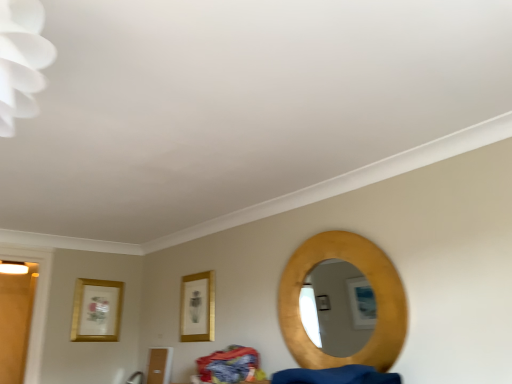
Image resolution: width=512 pixels, height=384 pixels. Describe the element at coordinates (96, 310) in the screenshot. I see `gold metallic picture frame at left, the 1th picture frame positioned from the left` at that location.

The image size is (512, 384). Describe the element at coordinates (197, 307) in the screenshot. I see `gold metallic picture frame at center, the 1th picture frame in the front-to-back sequence` at that location.

I want to click on gold metallic picture frame at left, the 1th picture frame positioned from the left, so click(x=96, y=310).

Find the location of a particular element. This screenshot has height=384, width=512. picture frame that is the 1st one when counting downward from the gold textured mirror at right (from the image's perspective) is located at coordinates pos(197,307).

Is gold textured mirror at right facing away from gold metallic picture frame at center, the 2th picture frame in the back-to-front sequence?

gold textured mirror at right does not have its back to gold metallic picture frame at center, the 2th picture frame in the back-to-front sequence.

Considering the relative sizes of gold textured mirror at right and gold metallic picture frame at center, the 1th picture frame in the front-to-back sequence, in the image provided, is gold textured mirror at right wider than gold metallic picture frame at center, the 1th picture frame in the front-to-back sequence,?

Indeed, gold textured mirror at right has a greater width compared to gold metallic picture frame at center, the 1th picture frame in the front-to-back sequence.

From the image's perspective, does gold metallic picture frame at left, the 1th picture frame positioned from the left, appear higher than gold textured mirror at right?

No, from the image's perspective, gold metallic picture frame at left, the 1th picture frame positioned from the left, is not over gold textured mirror at right.

Choose the correct answer: Is gold metallic picture frame at left, the second picture frame from the right, inside gold textured mirror at right or outside it?

gold metallic picture frame at left, the second picture frame from the right, lies outside gold textured mirror at right.

Is point (106, 284) positioned in front of point (291, 305)?

That is False.

Between gold metallic picture frame at left, the 1th picture frame positioned from the left, and gold textured mirror at right, which one appears on the left side from the viewer's perspective?

gold metallic picture frame at left, the 1th picture frame positioned from the left.

From a real-world perspective, is gold metallic picture frame at center, arranged as the first picture frame when viewed from the right, beneath gold textured mirror at right?

No.

From the image's perspective, does gold metallic picture frame at center, arranged as the first picture frame when viewed from the right, appear lower than gold textured mirror at right?

Correct, gold metallic picture frame at center, arranged as the first picture frame when viewed from the right, appears lower than gold textured mirror at right in the image.

Which is more to the right, gold metallic picture frame at center, the 2th picture frame in the back-to-front sequence, or gold textured mirror at right?

Positioned to the right is gold textured mirror at right.

Is gold metallic picture frame at center, the 1th picture frame in the front-to-back sequence, turned away from gold metallic picture frame at left, the 1th picture frame positioned from the left?

That's not correct — gold metallic picture frame at center, the 1th picture frame in the front-to-back sequence, is not looking away from gold metallic picture frame at left, the 1th picture frame positioned from the left.

In terms of width, does gold metallic picture frame at center, the 2th picture frame in the back-to-front sequence, look wider or thinner when compared to gold metallic picture frame at left, the second picture frame from the right?

In the image, gold metallic picture frame at center, the 2th picture frame in the back-to-front sequence, appears to be wider than gold metallic picture frame at left, the second picture frame from the right.

Between gold metallic picture frame at center, arranged as the first picture frame when viewed from the right, and gold metallic picture frame at left, which is the first picture frame in back-to-front order, which one is positioned behind?

gold metallic picture frame at left, which is the first picture frame in back-to-front order, is further away from the camera.

From the picture: Can you confirm if gold metallic picture frame at center, the 1th picture frame in the front-to-back sequence, is bigger than gold metallic picture frame at left, the 1th picture frame positioned from the left?

Correct, gold metallic picture frame at center, the 1th picture frame in the front-to-back sequence, is larger in size than gold metallic picture frame at left, the 1th picture frame positioned from the left.

Which of these two, gold textured mirror at right or gold metallic picture frame at left, which is counted as the 2th picture frame, starting from the front, is smaller?

gold metallic picture frame at left, which is counted as the 2th picture frame, starting from the front.

Which picture frame is the 2nd one when counting from the back of the gold textured mirror at right? Please provide its 2D coordinates.

[(96, 310)]

Looking at this image, considering the sizes of objects gold textured mirror at right and gold metallic picture frame at left, which is the first picture frame in back-to-front order, in the image provided, who is taller, gold textured mirror at right or gold metallic picture frame at left, which is the first picture frame in back-to-front order,?

With more height is gold textured mirror at right.

In the scene shown: Would you say gold metallic picture frame at left, the 1th picture frame positioned from the left, is a long distance from gold metallic picture frame at center, the 2th picture frame in the back-to-front sequence?

That's not correct — gold metallic picture frame at left, the 1th picture frame positioned from the left, is a little close to gold metallic picture frame at center, the 2th picture frame in the back-to-front sequence.

Considering the relative sizes of gold metallic picture frame at left, the 1th picture frame positioned from the left, and gold metallic picture frame at center, the 1th picture frame in the front-to-back sequence, in the image provided, is gold metallic picture frame at left, the 1th picture frame positioned from the left, bigger than gold metallic picture frame at center, the 1th picture frame in the front-to-back sequence,?

Actually, gold metallic picture frame at left, the 1th picture frame positioned from the left, might be smaller than gold metallic picture frame at center, the 1th picture frame in the front-to-back sequence.

Is gold metallic picture frame at center, the 1th picture frame in the front-to-back sequence, completely or partially inside gold metallic picture frame at left, which is counted as the 2th picture frame, starting from the front?

No, gold metallic picture frame at left, which is counted as the 2th picture frame, starting from the front, does not contain gold metallic picture frame at center, the 1th picture frame in the front-to-back sequence.

How different are the orientations of gold metallic picture frame at left, the 1th picture frame positioned from the left, and gold metallic picture frame at center, the 2th picture frame in the back-to-front sequence, in degrees?

89.2 degrees.

The height and width of the screenshot is (384, 512). I want to click on the 1st picture frame above the gold textured mirror at right (from a real-world perspective), so click(x=197, y=307).

From the gold textured mirror at right, count the 2nd picture frame to the left and point to it. Please provide its 2D coordinates.

[(96, 310)]

Estimate the real-world distances between objects in this image. Which object is further from gold metallic picture frame at center, the second picture frame when ordered from left to right, gold textured mirror at right or gold metallic picture frame at left, which is counted as the 2th picture frame, starting from the front?

gold textured mirror at right is further to gold metallic picture frame at center, the second picture frame when ordered from left to right.

Estimate the real-world distances between objects in this image. Which object is closer to gold metallic picture frame at center, the 2th picture frame in the back-to-front sequence, gold metallic picture frame at left, which is counted as the 2th picture frame, starting from the front, or gold textured mirror at right?

Based on the image, gold metallic picture frame at left, which is counted as the 2th picture frame, starting from the front, appears to be nearer to gold metallic picture frame at center, the 2th picture frame in the back-to-front sequence.

Looking at the image, which one is located further to gold textured mirror at right, gold metallic picture frame at center, the second picture frame when ordered from left to right, or gold metallic picture frame at left, which is the first picture frame in back-to-front order?

gold metallic picture frame at left, which is the first picture frame in back-to-front order, lies further to gold textured mirror at right than the other object.

From the image, which object appears to be farther from gold textured mirror at right, gold metallic picture frame at left, the second picture frame from the right, or gold metallic picture frame at center, the second picture frame when ordered from left to right?

Among the two, gold metallic picture frame at left, the second picture frame from the right, is located further to gold textured mirror at right.

Which object lies further to the anchor point gold metallic picture frame at left, the 1th picture frame positioned from the left, gold textured mirror at right or gold metallic picture frame at center, the 1th picture frame in the front-to-back sequence?

Based on the image, gold textured mirror at right appears to be further to gold metallic picture frame at left, the 1th picture frame positioned from the left.

From the image, which object appears to be farther from gold metallic picture frame at left, the second picture frame from the right, gold metallic picture frame at center, the 1th picture frame in the front-to-back sequence, or gold textured mirror at right?

The object further to gold metallic picture frame at left, the second picture frame from the right, is gold textured mirror at right.

Identify the location of picture frame between gold metallic picture frame at left, which is counted as the 2th picture frame, starting from the front, and gold textured mirror at right, in the horizontal direction. (197, 307).